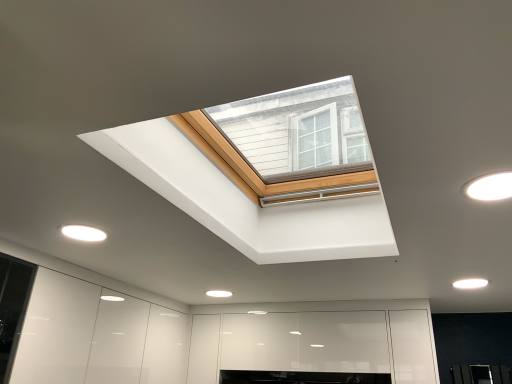
Image resolution: width=512 pixels, height=384 pixels. Find the location of `empty space that is ontop of white matte light fixture at lower right, which ranks as the third lighting in front-to-back order (from a real-world perspective)`. empty space that is ontop of white matte light fixture at lower right, which ranks as the third lighting in front-to-back order (from a real-world perspective) is located at coordinates (473, 281).